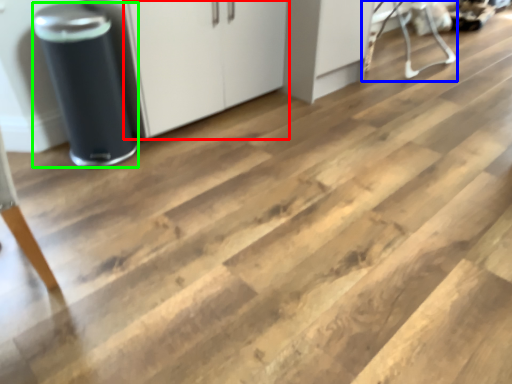
Question: Which is farther away from cabinetry (highlighted by a red box)? furniture (highlighted by a blue box) or appliance (highlighted by a green box)?

Choices:
 (A) furniture
 (B) appliance

Answer: (A)